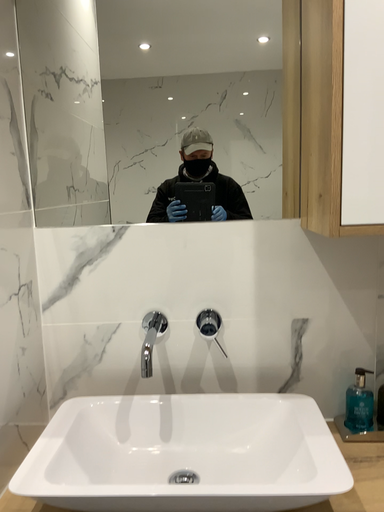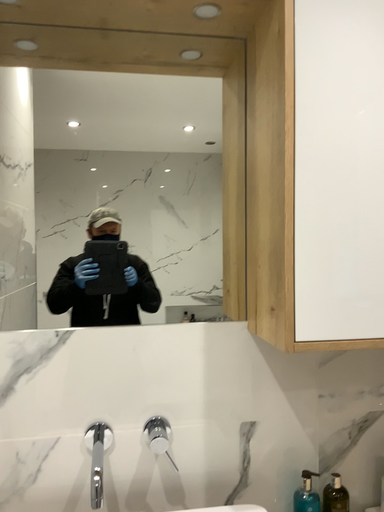
Question: How did the camera likely rotate when shooting the video?

Choices:
 (A) rotated right
 (B) rotated left

Answer: (A)